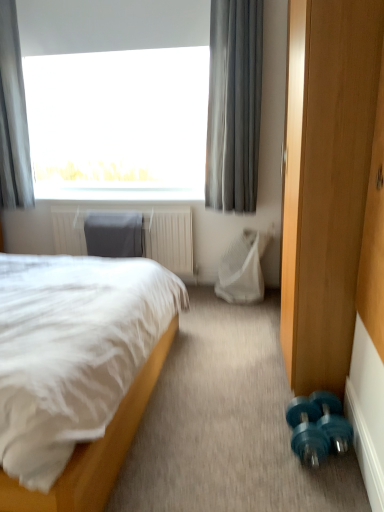
Locate an element on the screen. Image resolution: width=384 pixels, height=512 pixels. free space that is to the left of teal rubber dumbbell at lower right is located at coordinates coord(266,441).